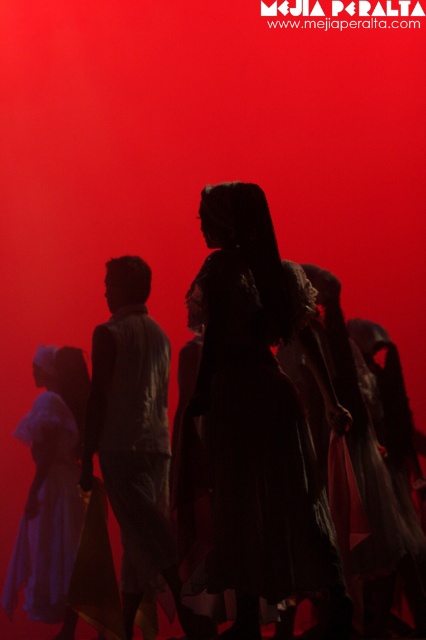
Between silhouette dress at center and matte gray shirt at center, which one appears on the right side from the viewer's perspective?

Positioned to the right is silhouette dress at center.

Does point (325, 400) come behind point (129, 570)?

No.

You are a GUI agent. You are given a task and a screenshot of the screen. Output one action in this format:
    pyautogui.click(x=<x>, y=<y>)
    Task: Click on the silhouette dress at center
    
    Given the screenshot: What is the action you would take?
    pyautogui.click(x=259, y=416)